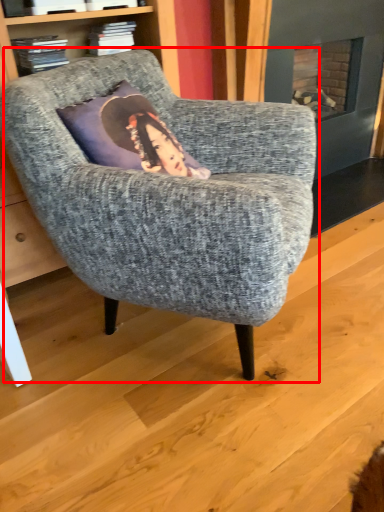
Question: Considering the relative positions of chair (annotated by the red box) and book in the image provided, where is chair (annotated by the red box) located with respect to the staircase?

Choices:
 (A) right
 (B) left

Answer: (A)